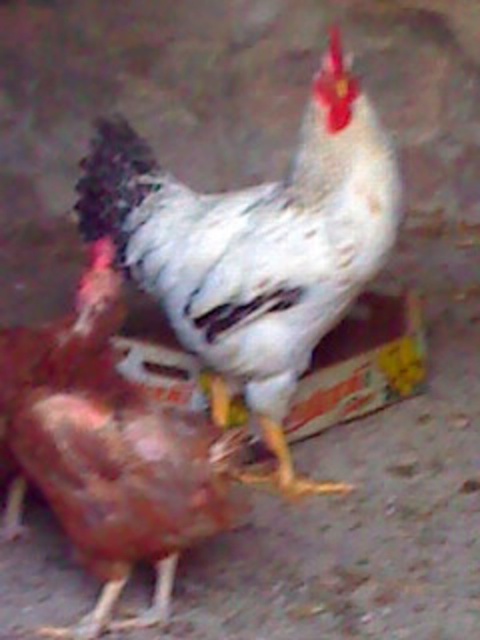
You are standing at the origin point of the coordinate system in the image. You want to move towards the point at coordinates point (254,248). Which chicken will you encounter first?

The point (254,248) is on white matte chicken at center, so you will encounter the white matte chicken at center first.

You are a farmer checking the health of your chickens. You notice that the white matte chicken at center and the shiny brown chicken at center are both standing on the same concrete surface. Which chicken has a taller height?

The white matte chicken at center has a greater height compared to the shiny brown chicken at center, so the white matte chicken at center is taller.

You are standing at the origin point in the image. The white matte chicken at center is at coordinates 0.388, 0.531. If you want to walk directly towards it, in which direction should you move?

To walk directly towards the white matte chicken at center located at coordinates (254, 248) from the origin, you should move northeast since the x and y coordinates are both positive.